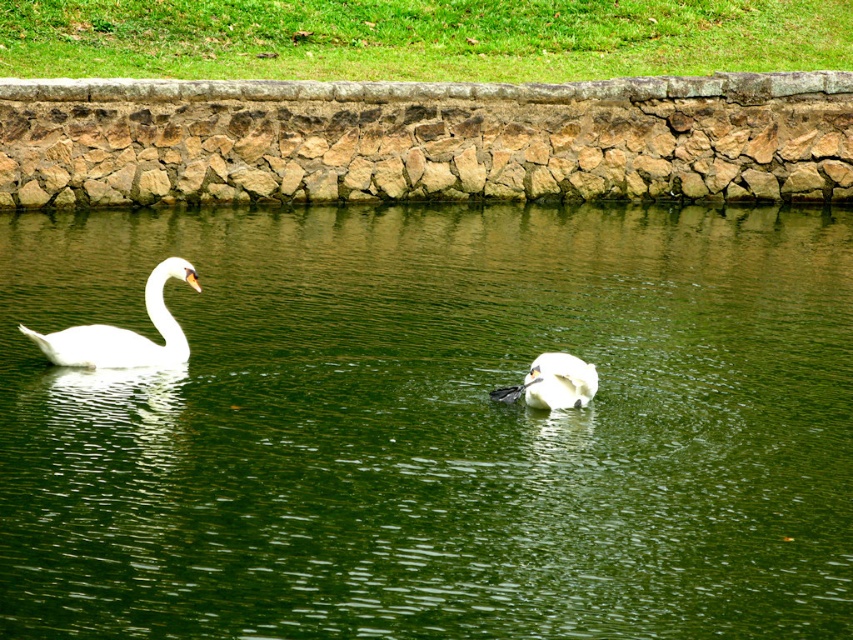
Question: Which object appears farthest from the camera in this image?

Choices:
 (A) white matte swan at center
 (B) white glossy swan at left
 (C) green liquid water at center

Answer: (B)

Question: Which object is positioned closest to the green liquid water at center?

Choices:
 (A) white glossy swan at left
 (B) white matte swan at center

Answer: (B)

Question: Observing the image, what is the correct spatial positioning of green liquid water at center in reference to white glossy swan at left?

Choices:
 (A) below
 (B) above

Answer: (B)

Question: Can you confirm if green liquid water at center is thinner than white matte swan at center?

Choices:
 (A) yes
 (B) no

Answer: (B)

Question: Which point is farther to the camera?

Choices:
 (A) (553, 365)
 (B) (196, 248)

Answer: (B)

Question: Is white glossy swan at left behind white matte swan at center?

Choices:
 (A) yes
 (B) no

Answer: (A)